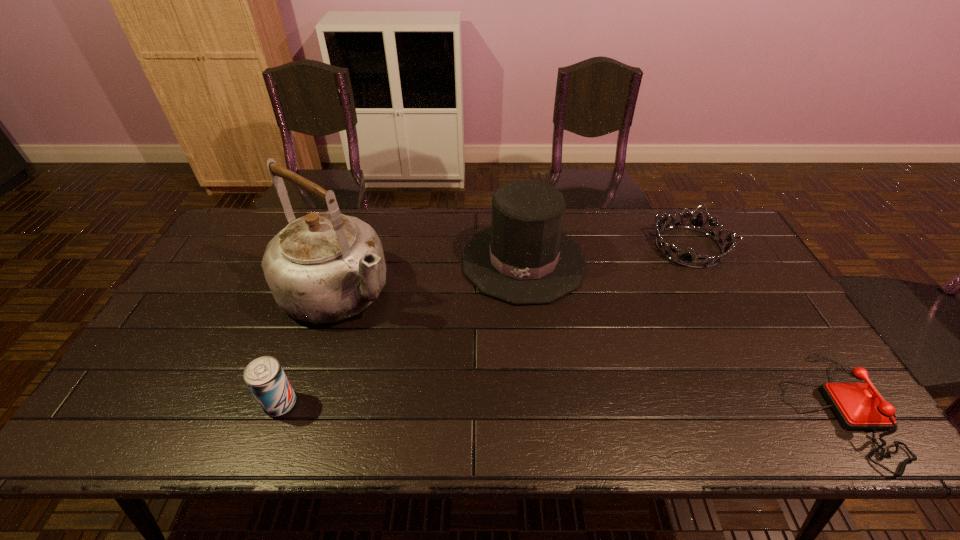
Find the location of a particular element. This screenshot has height=540, width=960. vacant space located 0.190m at the spout of the kettle is located at coordinates (431, 349).

In order to click on free space located 0.360m at the spout of the kettle in this screenshot , I will do `click(483, 384)`.

What are the coordinates of `vacant space located at the spout of the kettle` in the screenshot? It's located at (429, 347).

Find the location of a particular element. Image resolution: width=960 pixels, height=540 pixels. free spot located 0.180m on the front of the third object from right to left with the decoration is located at coordinates (505, 356).

You are a GUI agent. You are given a task and a screenshot of the screen. Output one action in this format:
    pyautogui.click(x=<x>, y=<y>)
    Task: Click on the vacant space situated on the front of the third object from right to left with the decoration
    
    Given the screenshot: What is the action you would take?
    500,383

You are a GUI agent. You are given a task and a screenshot of the screen. Output one action in this format:
    pyautogui.click(x=<x>, y=<y>)
    Task: Click on the blank space located on the front of the third object from right to left with the decoration
    The image size is (960, 540).
    Given the screenshot: What is the action you would take?
    pyautogui.click(x=509, y=338)

Identify the location of tiara that is positioned at the far edge. Image resolution: width=960 pixels, height=540 pixels. (685, 259).

Find the location of a particular element. dress hat present at the far edge is located at coordinates (524, 258).

The width and height of the screenshot is (960, 540). In order to click on beer can present at the near edge in this screenshot , I will do 264,376.

Image resolution: width=960 pixels, height=540 pixels. I want to click on telephone that is positioned at the near edge, so click(x=857, y=405).